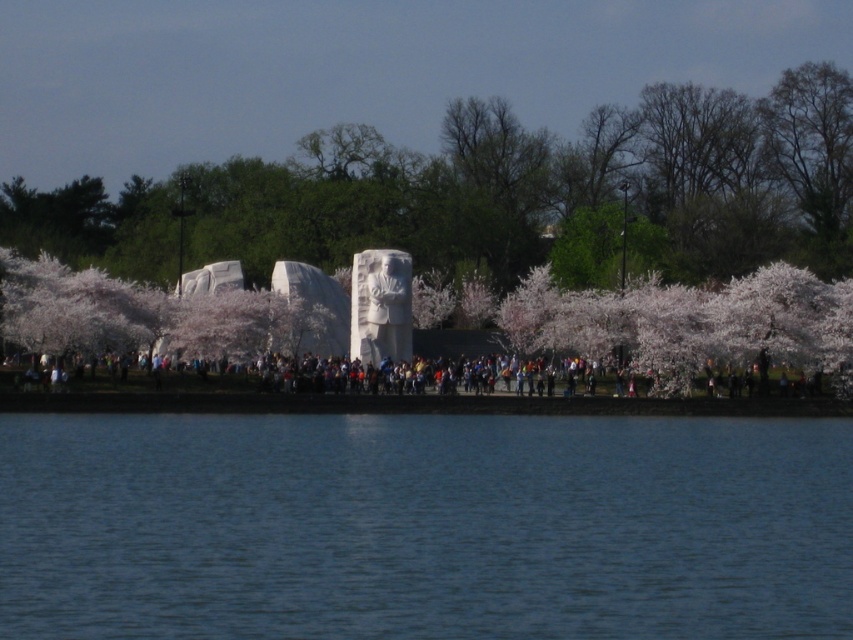
Question: Is blue water at lower center positioned before white stone sculpture at center?

Choices:
 (A) yes
 (B) no

Answer: (A)

Question: Which point appears closest to the camera in this image?

Choices:
 (A) (119, 378)
 (B) (762, 97)
 (C) (837, 435)

Answer: (C)

Question: Can you confirm if blue water at lower center is wider than multicolored clothing at center?

Choices:
 (A) yes
 (B) no

Answer: (B)

Question: Which point appears closest to the camera in this image?

Choices:
 (A) (846, 205)
 (B) (192, 442)

Answer: (B)

Question: In this image, where is white stone sculpture at center located relative to multicolored clothing at center?

Choices:
 (A) right
 (B) left

Answer: (B)

Question: Which of the following is the farthest from the observer?

Choices:
 (A) multicolored clothing at center
 (B) white stone sculpture at center
 (C) blue water at lower center

Answer: (B)